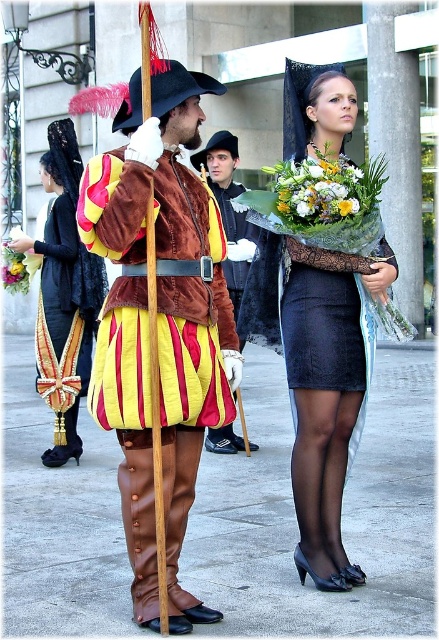
You are a photographer at the event and want to capture a photo where the velvet black cape at upper left is visible without being blocked by the floral bouquet at center. Based on their positions, is this possible?

The velvet black cape at upper left is positioned under the floral bouquet at center, so it is partially or fully hidden. To ensure visibility, adjust the angle or position to move the bouquet out of the way.

You are an artist trying to sketch the scene. You need to place the velvet brown coat at center in your drawing. According to the image, what are the coordinates where you should position it?

The velvet brown coat at center should be positioned at coordinates 0.506 on the x axis and 0.364 on the y axis as per the 2D location provided.

You are organizing a costume party and need to decide which item takes up more space. Based on the scene, which is bigger between the velvet black cape at upper left and the floral bouquet at center?

The velvet black cape at upper left is larger in size than the floral bouquet at center, so the velvet black cape at upper left takes up more space.